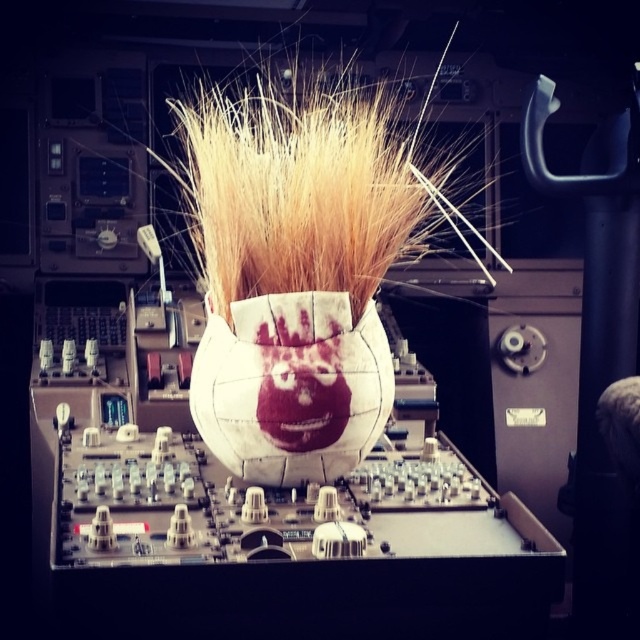
Question: Is golden straw hair at center below white fabric vase at center?

Choices:
 (A) no
 (B) yes

Answer: (A)

Question: Does golden straw hair at center have a lesser width compared to white fabric vase at center?

Choices:
 (A) no
 (B) yes

Answer: (A)

Question: Which point is closer to the camera?

Choices:
 (A) (273, 408)
 (B) (291, 67)

Answer: (A)

Question: Is golden straw hair at center positioned before white fabric vase at center?

Choices:
 (A) yes
 (B) no

Answer: (B)

Question: Among these objects, which one is nearest to the camera?

Choices:
 (A) golden straw hair at center
 (B) white fabric vase at center

Answer: (B)

Question: Which object is farther from the camera taking this photo?

Choices:
 (A) white fabric vase at center
 (B) golden straw hair at center

Answer: (B)